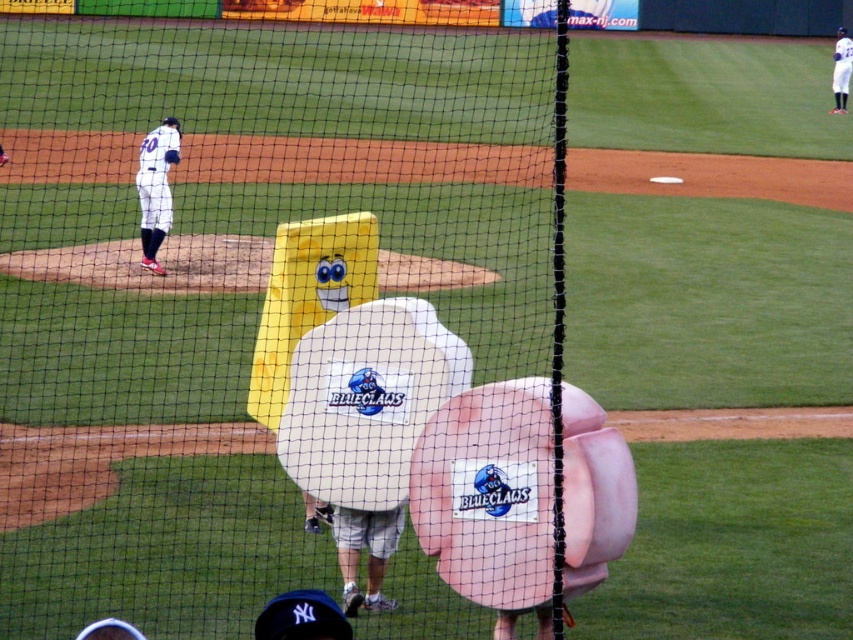
Question: Can you confirm if white jersey at center is positioned above white matte baseball cap at lower center?

Choices:
 (A) no
 (B) yes

Answer: (B)

Question: Where is white uniform at upper left located in relation to matte white glove at upper center in the image?

Choices:
 (A) above
 (B) below

Answer: (A)

Question: Which of these objects is positioned farthest from the black mesh net at center?

Choices:
 (A) white uniform at upper left
 (B) white matte baseball cap at lower center
 (C) white jersey at center
 (D) matte white glove at upper center

Answer: (B)

Question: Which of these objects is positioned closest to the white matte baseball cap at lower center?

Choices:
 (A) matte white glove at upper center
 (B) white uniform at upper left
 (C) black mesh net at center

Answer: (A)

Question: Among these objects, which one is farthest from the camera?

Choices:
 (A) white jersey at center
 (B) matte white glove at upper center

Answer: (B)

Question: Does black mesh net at center appear on the left side of matte white glove at upper center?

Choices:
 (A) no
 (B) yes

Answer: (B)